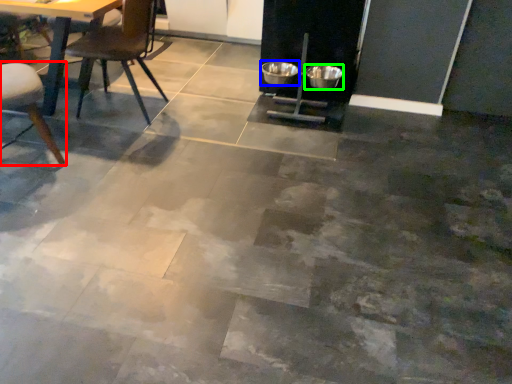
Question: Based on their relative distances, which object is nearer to chair (highlighted by a red box)? Choose from bowl (highlighted by a blue box) and bowl (highlighted by a green box).

Choices:
 (A) bowl
 (B) bowl

Answer: (A)